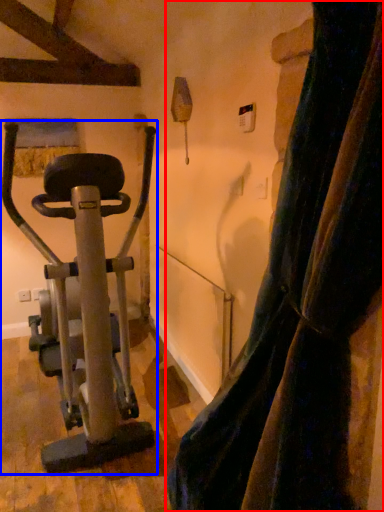
Question: Among these objects, which one is farthest to the camera, curtain (highlighted by a red box) or stationary bicycle (highlighted by a blue box)?

Choices:
 (A) curtain
 (B) stationary bicycle

Answer: (B)